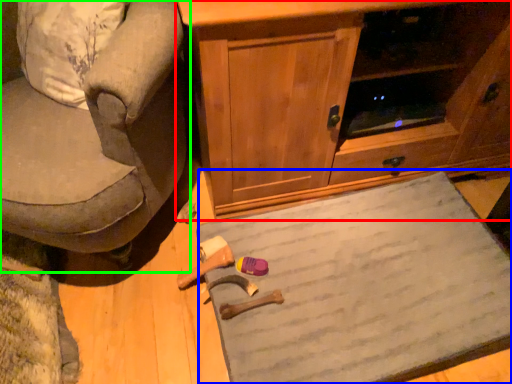
Question: Estimate the real-world distances between objects in this image. Which object is farther from cabinetry (highlighted by a red box), doormat (highlighted by a blue box) or chair (highlighted by a green box)?

Choices:
 (A) doormat
 (B) chair

Answer: (B)